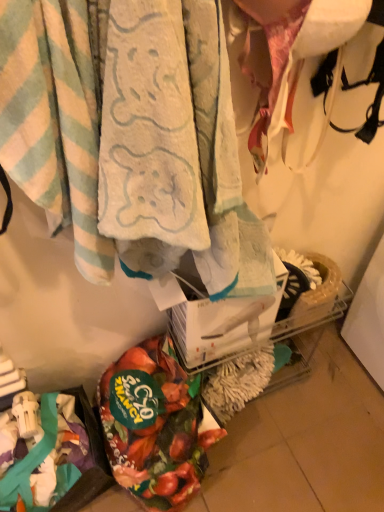
Question: Is floral fabric bag at lower left to the right of soft cotton towel at center, which ranks as the 2th towel in left-to-right order, from the viewer's perspective?

Choices:
 (A) no
 (B) yes

Answer: (A)

Question: Could you tell me if floral fabric bag at lower left is turned towards soft cotton towel at center, which ranks as the 2th towel in left-to-right order?

Choices:
 (A) yes
 (B) no

Answer: (B)

Question: From a real-world perspective, is floral fabric bag at lower left over soft cotton towel at center, which ranks as the 2th towel in left-to-right order?

Choices:
 (A) yes
 (B) no

Answer: (B)

Question: Does floral fabric bag at lower left contain soft cotton towel at center, which appears as the first towel when viewed from the right?

Choices:
 (A) no
 (B) yes

Answer: (A)

Question: Can you confirm if floral fabric bag at lower left is shorter than soft cotton towel at center, which ranks as the 2th towel in left-to-right order?

Choices:
 (A) no
 (B) yes

Answer: (B)

Question: From a real-world perspective, does floral fabric bag at lower left sit lower than soft cotton towel at center, which ranks as the 2th towel in left-to-right order?

Choices:
 (A) yes
 (B) no

Answer: (A)

Question: Would you say light blue striped towel at upper left, marked as the 1th towel in a left-to-right arrangement, is outside floral fabric bag at lower left?

Choices:
 (A) no
 (B) yes

Answer: (B)

Question: Can you confirm if light blue striped towel at upper left, arranged as the second towel when viewed from the right, is thinner than floral fabric bag at lower left?

Choices:
 (A) no
 (B) yes

Answer: (B)

Question: Can you see light blue striped towel at upper left, marked as the 1th towel in a left-to-right arrangement, touching floral fabric bag at lower left?

Choices:
 (A) yes
 (B) no

Answer: (B)

Question: From the image's perspective, is light blue striped towel at upper left, marked as the 1th towel in a left-to-right arrangement, located above floral fabric bag at lower left?

Choices:
 (A) no
 (B) yes

Answer: (B)

Question: Is floral fabric bag at lower left inside light blue striped towel at upper left, arranged as the second towel when viewed from the right?

Choices:
 (A) no
 (B) yes

Answer: (A)

Question: From a real-world perspective, is light blue striped towel at upper left, arranged as the second towel when viewed from the right, on top of floral fabric bag at lower left?

Choices:
 (A) yes
 (B) no

Answer: (A)

Question: From the image's perspective, is light blue striped towel at upper left, arranged as the second towel when viewed from the right, above soft cotton towel at center, which ranks as the 2th towel in left-to-right order?

Choices:
 (A) no
 (B) yes

Answer: (A)